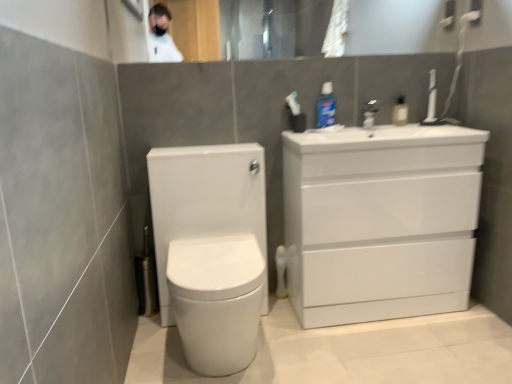
Image resolution: width=512 pixels, height=384 pixels. I want to click on vacant space situated on the left part of clear plastic bottle at upper center, the 2th toiletry in the left-to-right sequence, so pos(377,124).